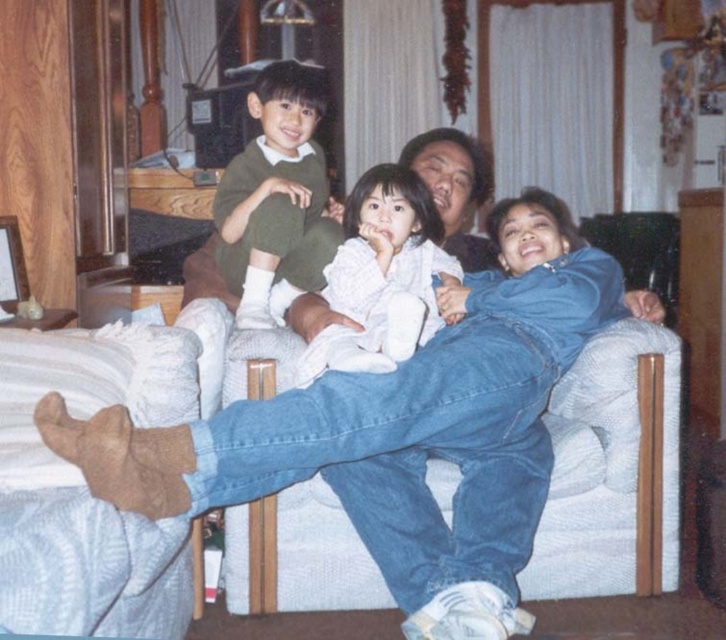
Between matte green sweater at center and white soft blanket at center, which one appears on the right side from the viewer's perspective?

white soft blanket at center is more to the right.

Looking at this image, can you confirm if matte green sweater at center is positioned to the right of white soft blanket at center?

In fact, matte green sweater at center is to the left of white soft blanket at center.

Where is `matte green sweater at center`? This screenshot has width=726, height=640. matte green sweater at center is located at coordinates (277, 198).